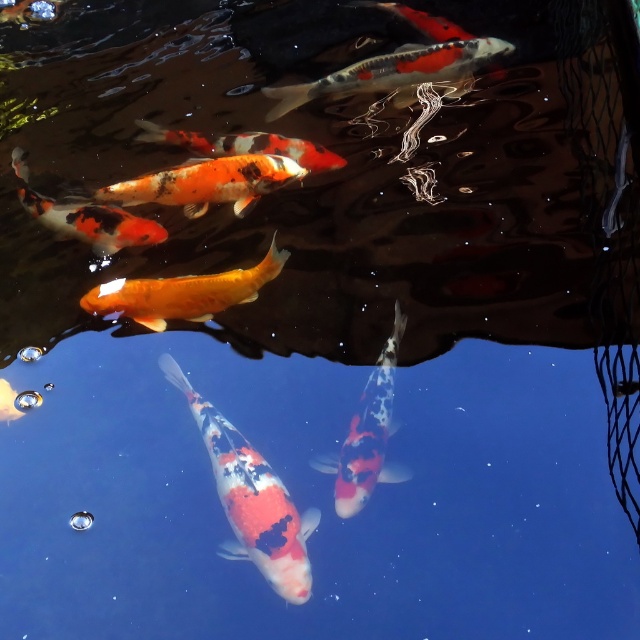
Question: Does speckled orange fish at center have a larger size compared to orange and white speckled fish at left?

Choices:
 (A) yes
 (B) no

Answer: (B)

Question: Among these objects, which one is farthest from the camera?

Choices:
 (A) orange and white speckled fish at left
 (B) speckled orange and white fish at center
 (C) speckled orange fish at center
 (D) orange and white speckled goldfish at center

Answer: (A)

Question: Among these objects, which one is farthest from the camera?

Choices:
 (A) speckled orange fish at center
 (B) shiny orange and white fish at center
 (C) speckled orange and white fish at center

Answer: (B)

Question: Which point appears closest to the camera in this image?

Choices:
 (A) (301, 145)
 (B) (256, 456)
 (C) (342, 452)
 (D) (129, 180)

Answer: (B)

Question: Is speckled orange and white fish at center to the right of orange and white speckled goldfish at center from the viewer's perspective?

Choices:
 (A) yes
 (B) no

Answer: (A)

Question: Can you confirm if orange and white speckled goldfish at center is positioned to the left of shiny orange and white fish at center?

Choices:
 (A) no
 (B) yes

Answer: (B)